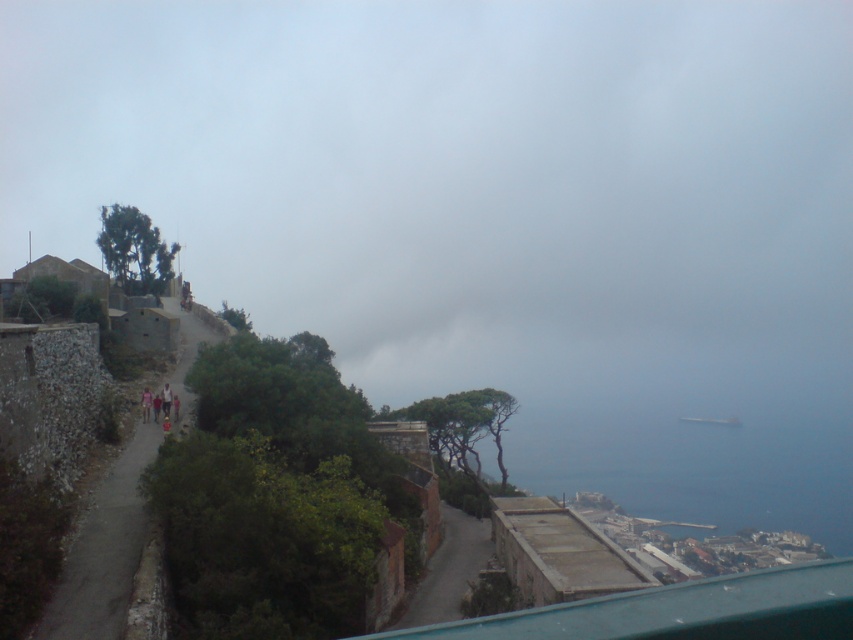
Question: Is gray fog at upper center closer to camera compared to blue water at lower right?

Choices:
 (A) no
 (B) yes

Answer: (A)

Question: Is gray fog at upper center wider than blue water at lower right?

Choices:
 (A) no
 (B) yes

Answer: (B)

Question: Is gray fog at upper center positioned before blue water at lower right?

Choices:
 (A) no
 (B) yes

Answer: (A)

Question: Which of the following is the closest to the observer?

Choices:
 (A) blue water at lower right
 (B) gray fog at upper center

Answer: (A)